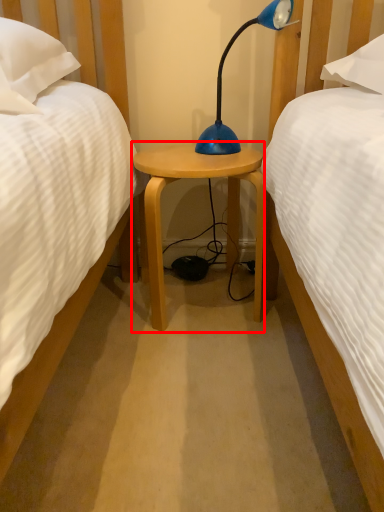
Question: From the image's perspective, what is the correct spatial positioning of nightstand (annotated by the red box) in reference to lamp?

Choices:
 (A) below
 (B) above

Answer: (A)